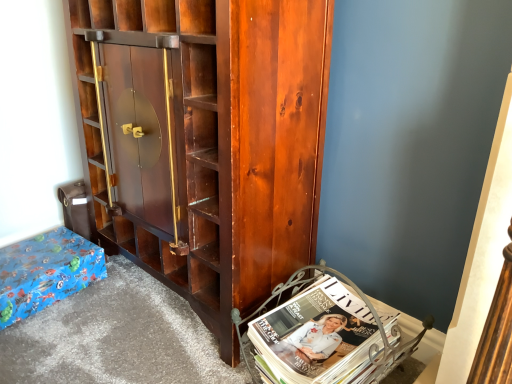
Locate an element on the screen. The height and width of the screenshot is (384, 512). free space above blue wrapping paper at lower left (from a real-world perspective) is located at coordinates (34, 250).